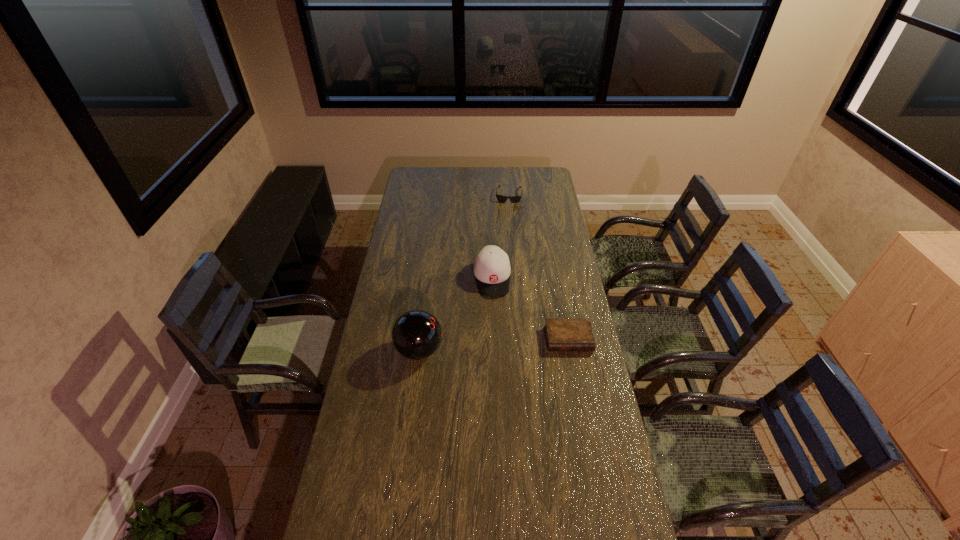
Where is `vacant space on the desktop that is between the leftmost object and the rightmost object and is positioned on the front-facing side of the sunglasses`? The image size is (960, 540). vacant space on the desktop that is between the leftmost object and the rightmost object and is positioned on the front-facing side of the sunglasses is located at coordinates (493, 345).

At what (x,y) coordinates should I click in order to perform the action: click on free space on the desktop that is between the bowling ball and the rightmost object and is positioned on the front-facing side of the third shortest object. Please return your answer as a coordinate pair (x, y). This screenshot has height=540, width=960. Looking at the image, I should click on (499, 345).